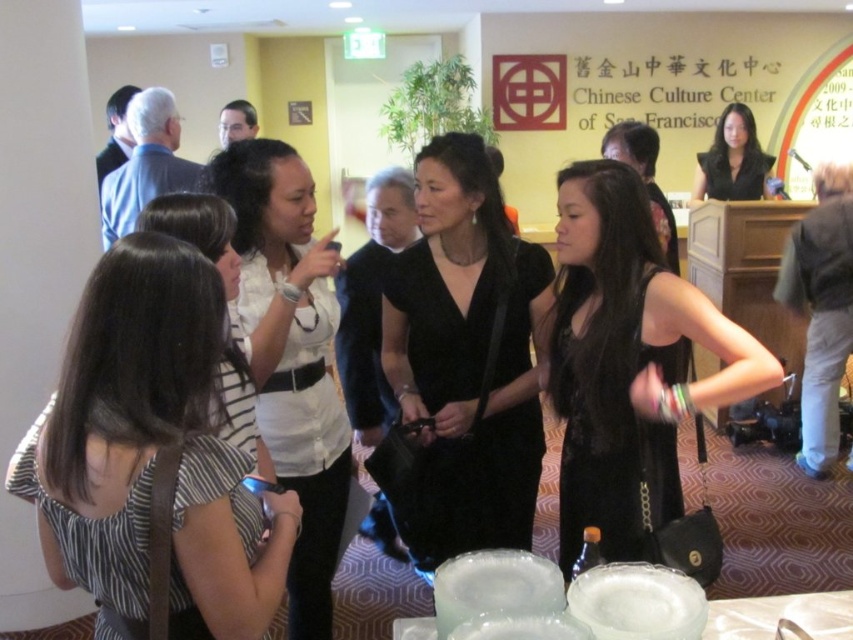
You are standing in the Chinese Culture Center of San Francisco and notice two points marked in the scene. Which point, point (395, 538) or point (769, 612), is closer to you?

Point (395, 538) is closer to you because it is further to the camera than point (769, 612).